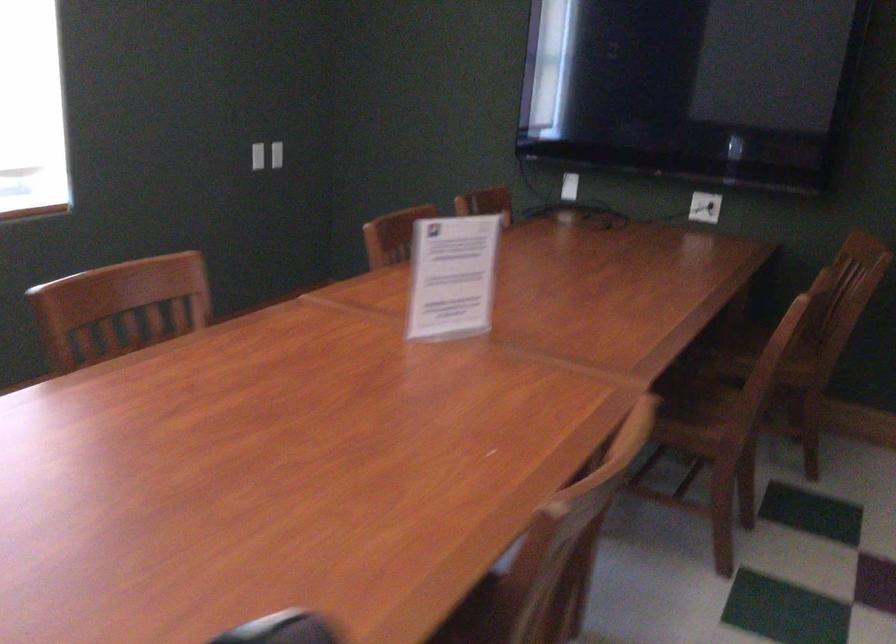
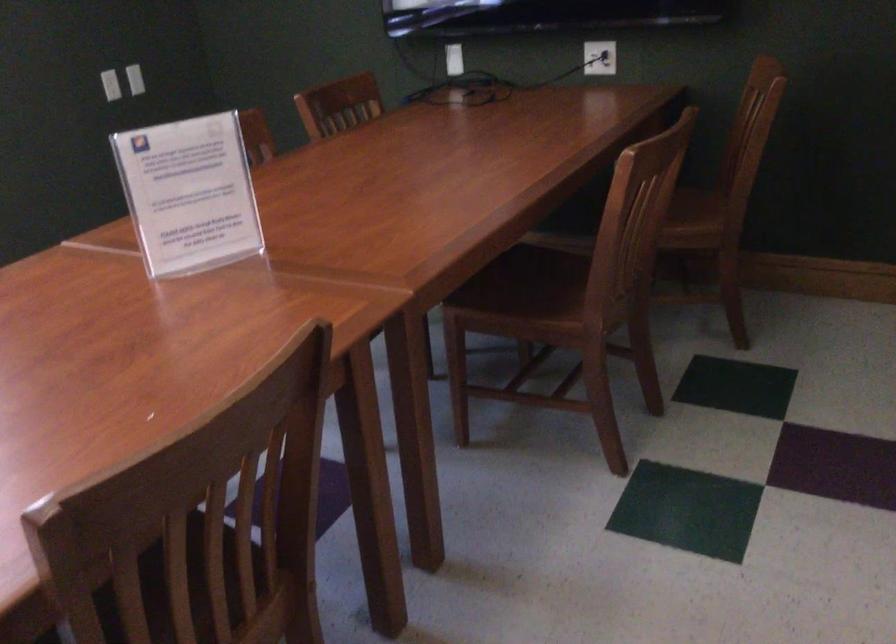
In the second image, find the point that corresponds to point (574, 184) in the first image.

(453, 59)